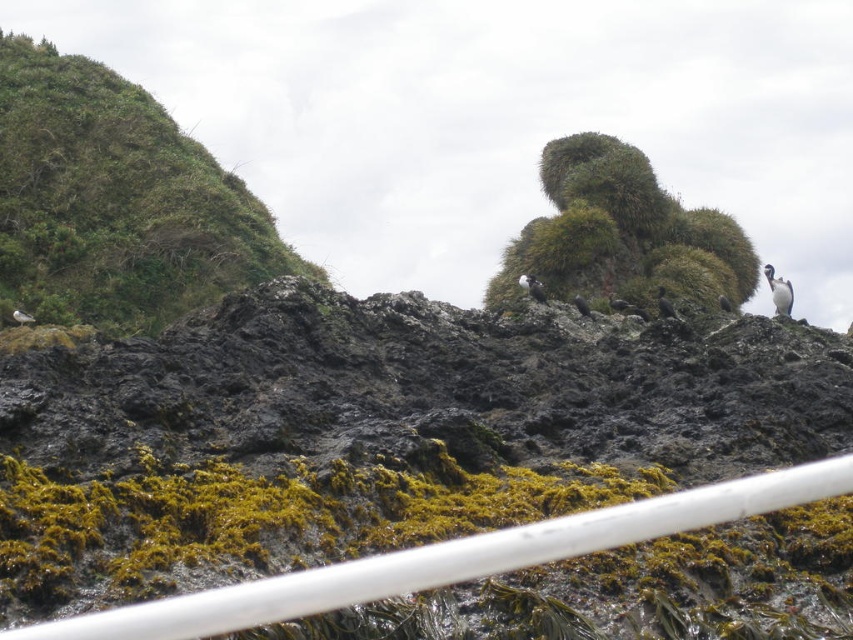
Question: Which is farther from the dark gray feathers at center?

Choices:
 (A) black matte bird at center
 (B) white plastic rail at lower center
 (C) white fluffy bird at upper right

Answer: (B)

Question: Which point is closer to the camera?

Choices:
 (A) (724, 310)
 (B) (122, 636)

Answer: (B)

Question: Is white fluffy bird at upper right in front of dark gray feathers at center?

Choices:
 (A) no
 (B) yes

Answer: (A)

Question: Does dark gray feathers at center appear on the right side of dark brown feathers at upper right?

Choices:
 (A) yes
 (B) no

Answer: (B)

Question: Which is nearer to the dark gray feathers at center?

Choices:
 (A) white plastic rail at lower center
 (B) black glossy penguin at center-right
 (C) green mossy hillside at upper left
 (D) black matte bird at center

Answer: (D)

Question: Where is green mossy hillside at upper left located in relation to black matte bird at center in the image?

Choices:
 (A) below
 (B) above

Answer: (B)